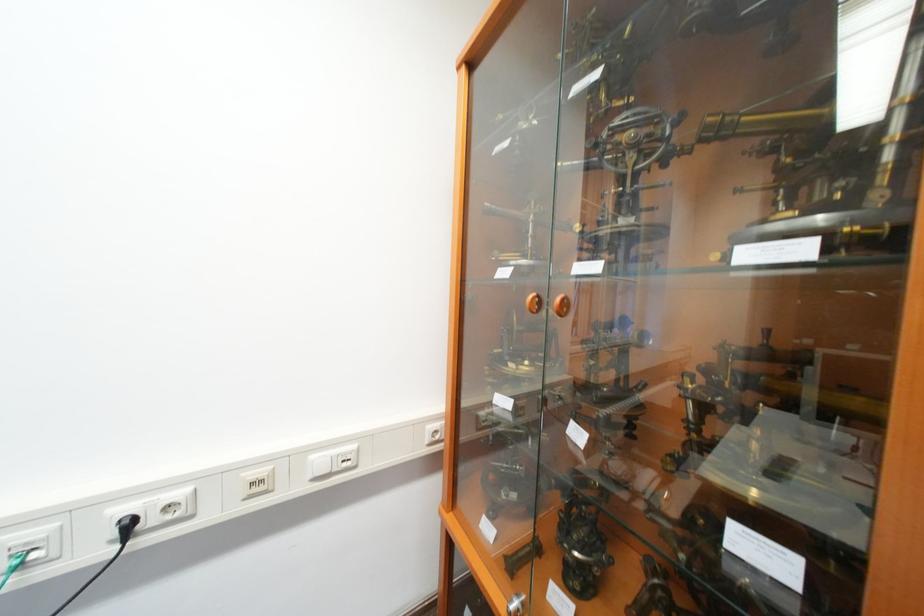
What are the coordinates of `black electrical plug` in the screenshot? It's located at (127, 527).